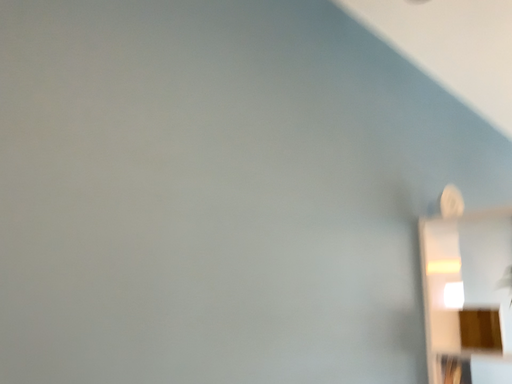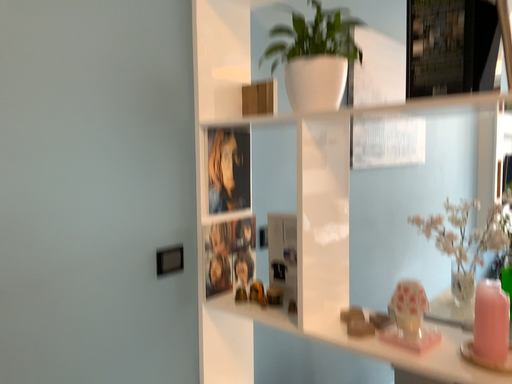
Question: Which way did the camera rotate in the video?

Choices:
 (A) rotated left
 (B) rotated right

Answer: (B)